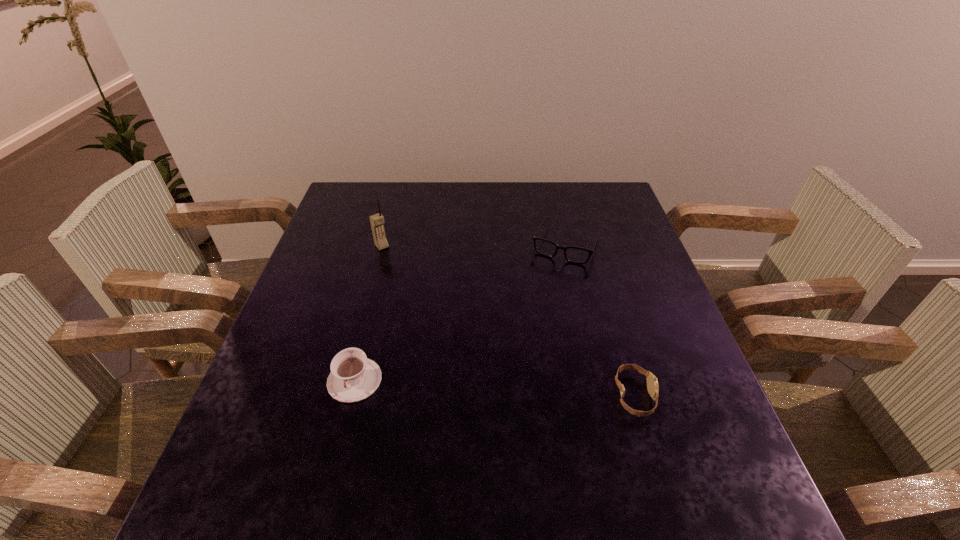
The image size is (960, 540). I want to click on free spot on the desktop that is between the teacup and the shortest object and is positioned on the front-facing side of the spectacles, so click(503, 388).

Image resolution: width=960 pixels, height=540 pixels. Identify the location of vacant space on the desktop that is between the teacup and the watch and is positioned on the front of the cellular telephone, where the keypad is located. (505, 389).